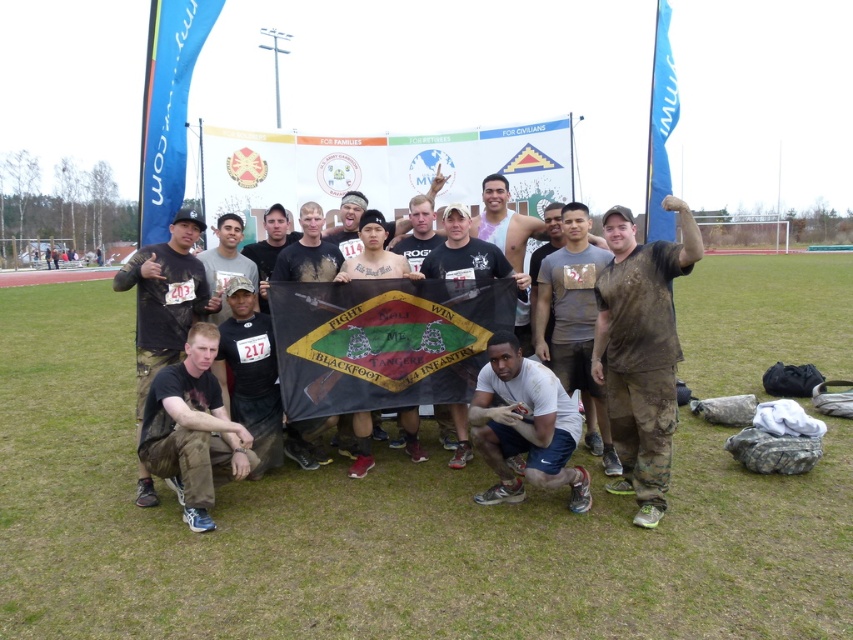
You are standing at the point with coordinates point (x=260, y=372) and want to walk to the point with coordinates point (x=798, y=284). Which direction should you move in to reach your destination?

You should move backward to reach point (x=798, y=284) from point (x=260, y=372) because point (x=798, y=284) is behind point (x=260, y=372).